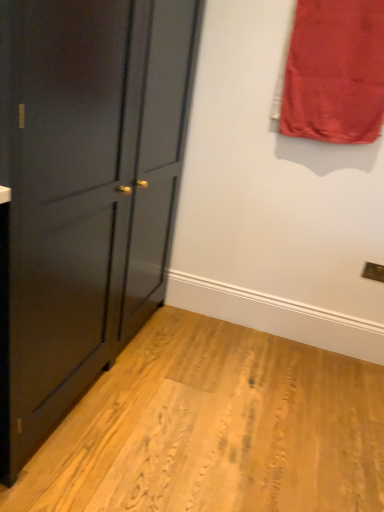
Question: Is matte black cabinet at left at the back of red satin curtain at upper right?

Choices:
 (A) no
 (B) yes

Answer: (A)

Question: From a real-world perspective, is red satin curtain at upper right on matte black cabinet at left?

Choices:
 (A) no
 (B) yes

Answer: (B)

Question: Does red satin curtain at upper right lie behind matte black cabinet at left?

Choices:
 (A) no
 (B) yes

Answer: (B)

Question: Does red satin curtain at upper right have a greater width compared to matte black cabinet at left?

Choices:
 (A) yes
 (B) no

Answer: (B)

Question: Is red satin curtain at upper right outside matte black cabinet at left?

Choices:
 (A) no
 (B) yes

Answer: (B)

Question: Can matte black cabinet at left be found inside red satin curtain at upper right?

Choices:
 (A) yes
 (B) no

Answer: (B)

Question: Can you confirm if matte black cabinet at left is bigger than red satin curtain at upper right?

Choices:
 (A) yes
 (B) no

Answer: (A)

Question: Is matte black cabinet at left not within red satin curtain at upper right?

Choices:
 (A) yes
 (B) no

Answer: (A)

Question: Is matte black cabinet at left not close to red satin curtain at upper right?

Choices:
 (A) yes
 (B) no

Answer: (B)

Question: Considering the relative positions of matte black cabinet at left and red satin curtain at upper right in the image provided, is matte black cabinet at left to the left of red satin curtain at upper right from the viewer's perspective?

Choices:
 (A) yes
 (B) no

Answer: (A)

Question: Is matte black cabinet at left to the right of red satin curtain at upper right from the viewer's perspective?

Choices:
 (A) no
 (B) yes

Answer: (A)

Question: Is red satin curtain at upper right inside matte black cabinet at left?

Choices:
 (A) yes
 (B) no

Answer: (B)

Question: Which is correct: matte black cabinet at left is inside red satin curtain at upper right, or outside of it?

Choices:
 (A) outside
 (B) inside

Answer: (A)